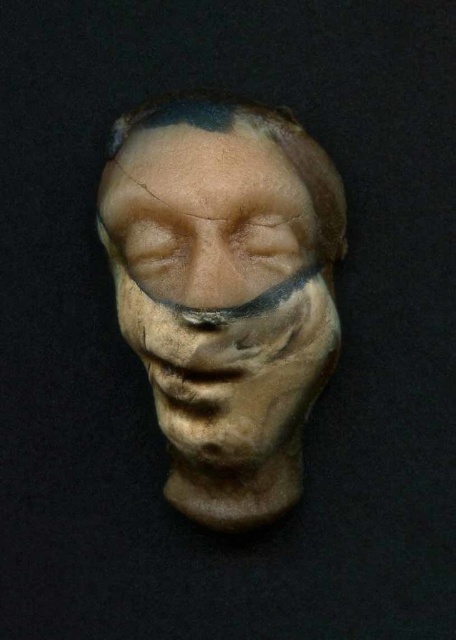
Question: Among these points, which one is nearest to the camera?

Choices:
 (A) (176, 115)
 (B) (269, 358)
 (C) (165, 272)
 (D) (258, 234)

Answer: (A)

Question: Which of the following is the farthest from the observer?

Choices:
 (A) brown matte eyebrow at upper center
 (B) matte clay eye at center
 (C) matte brown eye at center
 (D) matte clay face at center

Answer: (B)

Question: Is brown matte eyebrow at upper center bigger than matte clay eye at center?

Choices:
 (A) no
 (B) yes

Answer: (B)

Question: Can you confirm if brown matte eyebrow at upper center is positioned to the right of matte clay eye at center?

Choices:
 (A) no
 (B) yes

Answer: (B)

Question: Which object is closer to the camera taking this photo?

Choices:
 (A) matte clay eye at center
 (B) matte clay face at center
 (C) matte brown eye at center

Answer: (B)

Question: Does brown matte eyebrow at upper center have a greater width compared to matte brown eye at center?

Choices:
 (A) no
 (B) yes

Answer: (B)